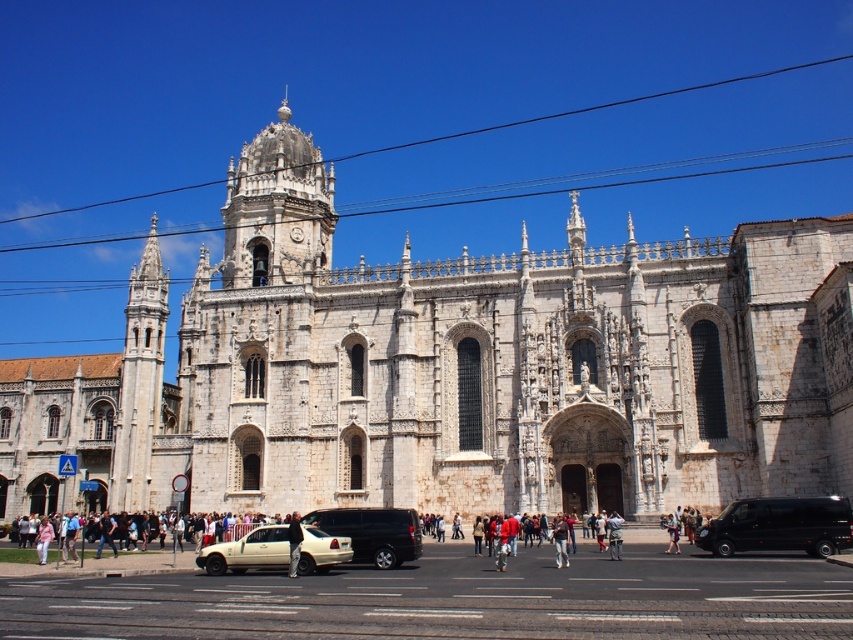
Question: Among these points, which one is farthest from the camera?

Choices:
 (A) (373, 525)
 (B) (554, 520)
 (C) (28, 552)

Answer: (C)

Question: Does matte white sedan at center have a larger size compared to dark gray fabric jacket at center?

Choices:
 (A) yes
 (B) no

Answer: (B)

Question: Is white stone church at center above dark gray fabric jacket at center?

Choices:
 (A) no
 (B) yes

Answer: (B)

Question: Which point appears closest to the camera in this image?

Choices:
 (A) (527, 416)
 (B) (273, 531)

Answer: (B)

Question: Which point is farther to the camera?

Choices:
 (A) click(563, 561)
 (B) click(296, 538)
 (C) click(672, 520)
 (D) click(335, 556)

Answer: (C)

Question: Is white stone church at center positioned before white stone tower at upper left?

Choices:
 (A) yes
 (B) no

Answer: (A)